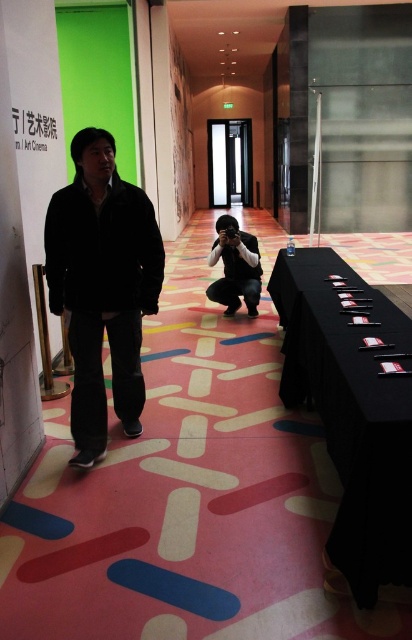
Is dark matte jacket at center positioned at the back of matte black camera at center?

No, dark matte jacket at center is in front of matte black camera at center.

Does dark matte jacket at center appear under matte black camera at center?

Correct, dark matte jacket at center is located below matte black camera at center.

Does point (110, 356) come farther from viewer compared to point (236, 250)?

No, (110, 356) is closer to viewer.

Where is `dark matte jacket at center`? dark matte jacket at center is located at coordinates (102, 285).

Between black fabric table at lower right and dark matte jacket at center, which one has more height?

With more height is dark matte jacket at center.

Can you confirm if black fabric table at lower right is thinner than dark matte jacket at center?

Correct, black fabric table at lower right's width is less than dark matte jacket at center's.

Is point (379, 301) farther from viewer compared to point (91, 289)?

That is True.

The width and height of the screenshot is (412, 640). Find the location of `black fabric table at lower right`. black fabric table at lower right is located at coordinates (353, 406).

Does point (332, 426) come behind point (241, 296)?

No, it is in front of (241, 296).

Which is above, black fabric table at lower right or matte black camera at center?

Positioned higher is matte black camera at center.

Locate an element on the screen. black fabric table at lower right is located at coordinates (353, 406).

Locate an element on the screen. The height and width of the screenshot is (640, 412). black fabric table at lower right is located at coordinates (353, 406).